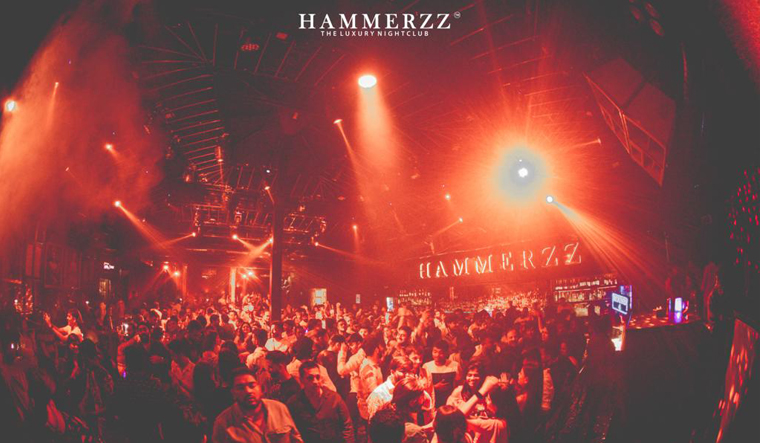
Locate an element on the screen. This screenshot has height=443, width=760. led text is located at coordinates (486, 265).